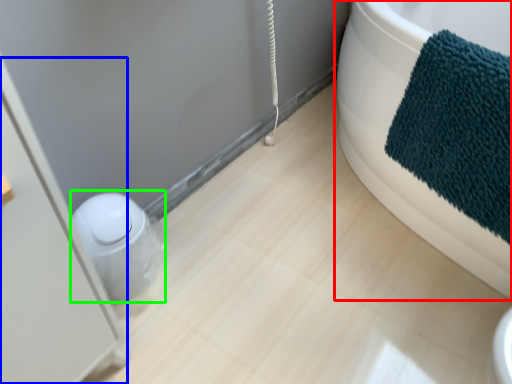
Question: Based on their relative distances, which object is farther from bathtub (highlighted by a red box)? Choose from screen door (highlighted by a blue box) and toilet bowl (highlighted by a green box).

Choices:
 (A) screen door
 (B) toilet bowl

Answer: (A)